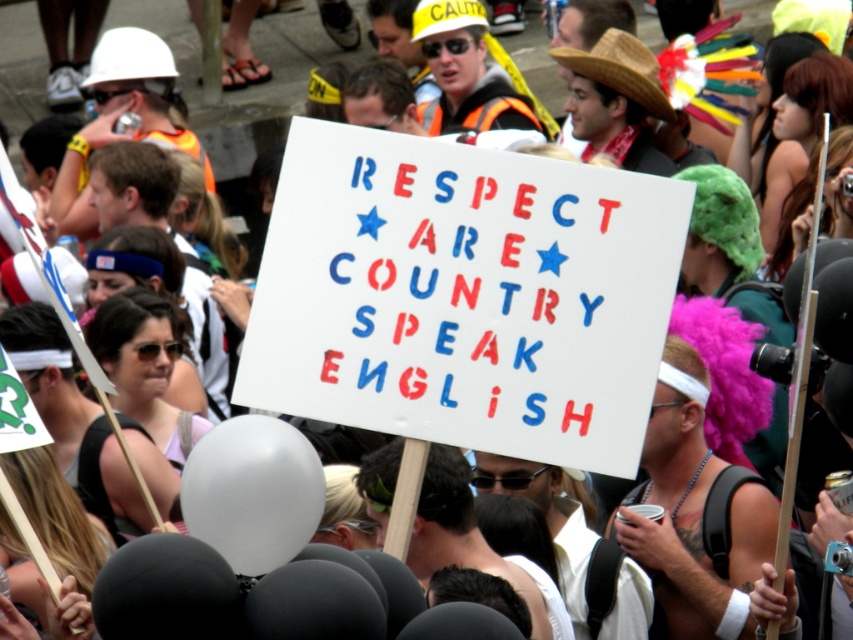
You are standing in the crowd and want to take a photo of both the sign and the person holding it. You notice two points of interest marked as point 1 at coordinates (497, 154) and point 2 at coordinates (190, 499). Which point should you focus on first to ensure both are in focus?

Point 1 at coordinates (497, 154) is further to the camera than point 2 at coordinates (190, 499). To ensure both are in focus, you should focus on point 2 first since it is closer and adjusting focus from there might help both points be sharp.